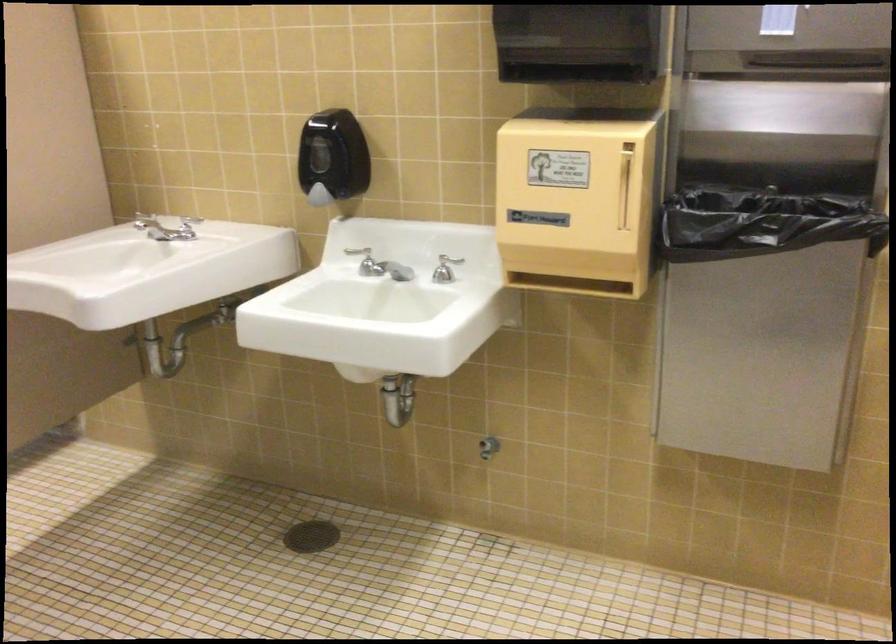
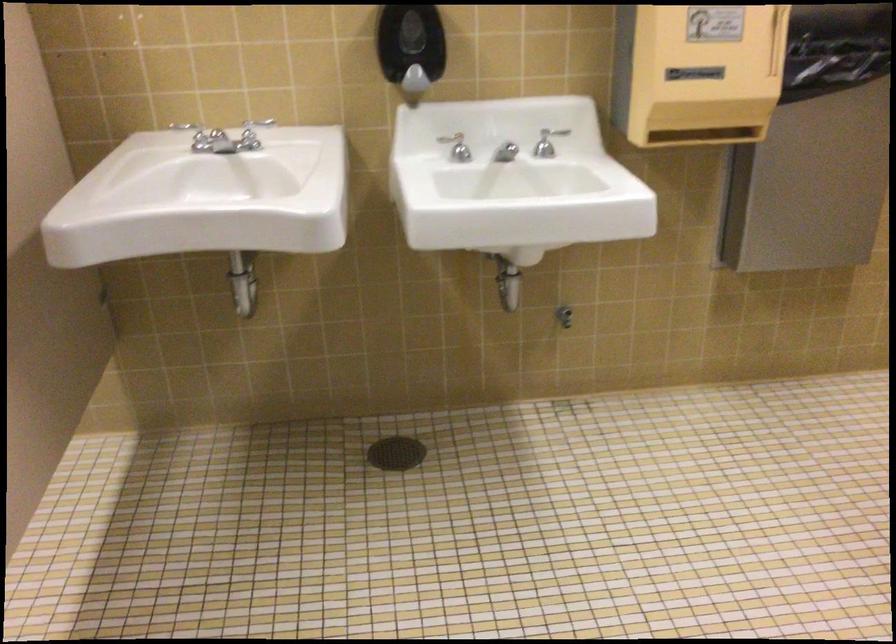
Find the pixel in the second image that matches (418,272) in the first image.

(505, 152)